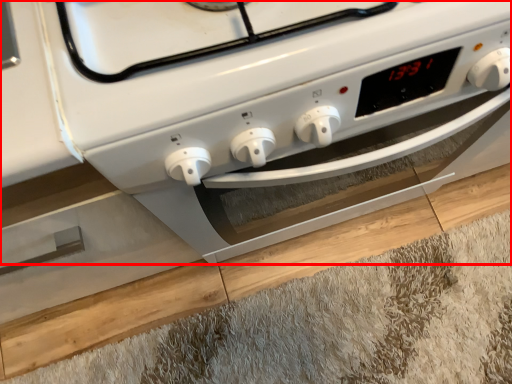
Question: Where is home appliance (annotated by the red box) located in relation to hardwood in the image?

Choices:
 (A) left
 (B) right

Answer: (A)